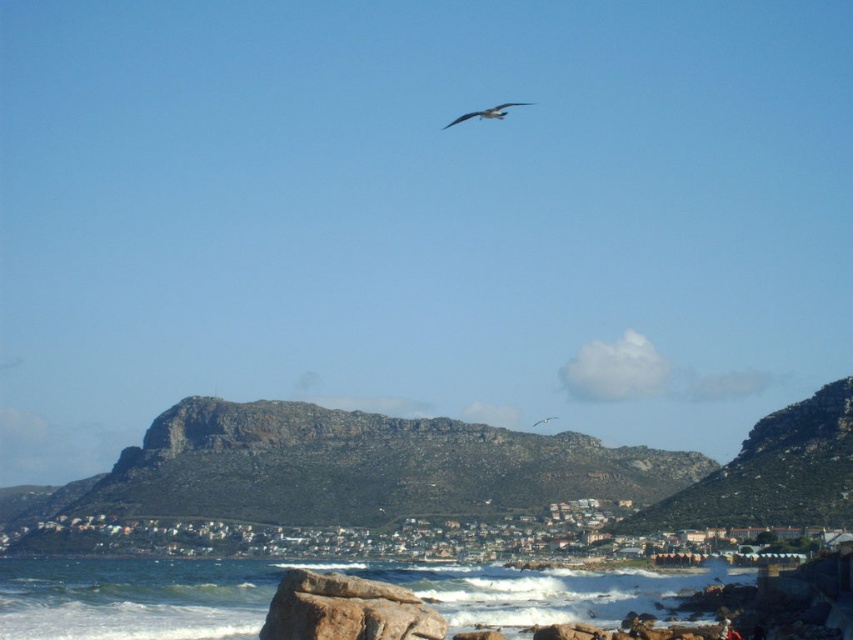
Between point (213, 612) and point (490, 109), which one is positioned in front?

Positioned in front is point (213, 612).

Between point (537, 608) and point (503, 109), which one is positioned in front?

Point (537, 608) is more forward.

The width and height of the screenshot is (853, 640). In order to click on clear water at lower center in this screenshot , I will do `click(317, 570)`.

Does point (358, 580) come farther from viewer compared to point (497, 112)?

That is False.

Is the position of brown rough rock at lower center less distant than that of white feathered bird at upper center?

Yes, it is.

Which is behind, point (422, 621) or point (497, 115)?

The point (497, 115) is more distant.

You are a GUI agent. You are given a task and a screenshot of the screen. Output one action in this format:
    pyautogui.click(x=<x>, y=<y>)
    Task: Click on the brown rough rock at lower center
    This screenshot has height=640, width=853.
    Given the screenshot: What is the action you would take?
    pyautogui.click(x=346, y=609)

In the scene shown: Can you confirm if clear water at lower center is smaller than brown rough rock at lower center?

Incorrect, clear water at lower center is not smaller in size than brown rough rock at lower center.

Which is more to the left, clear water at lower center or brown rough rock at lower center?

clear water at lower center

Where is `clear water at lower center`? Image resolution: width=853 pixels, height=640 pixels. clear water at lower center is located at coordinates (317, 570).